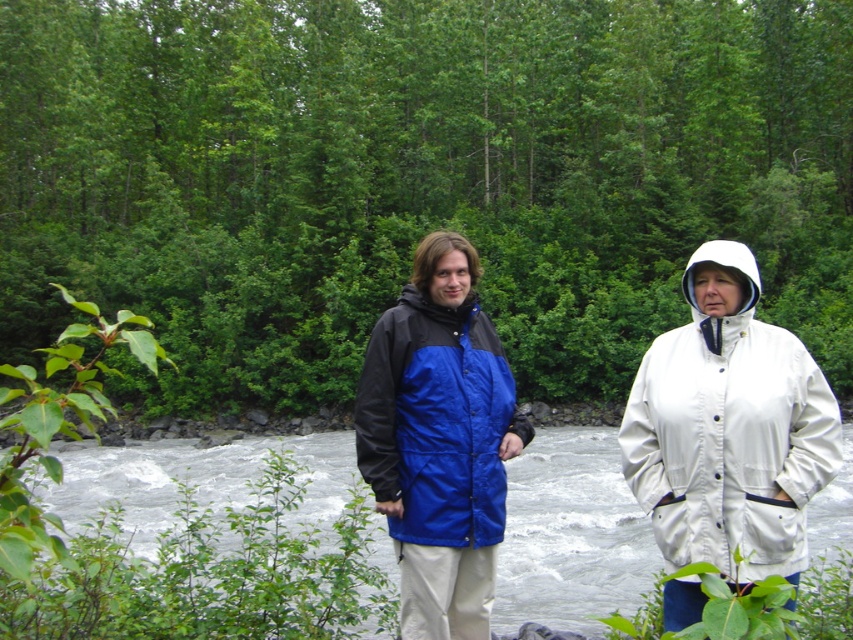
Question: Which point is closer to the camera?

Choices:
 (A) blue/black jacket at center
 (B) blue/white waterproof jacket at center
 (C) white water at river center

Answer: (C)

Question: Is blue/white waterproof jacket at center closer to camera compared to blue/black jacket at center?

Choices:
 (A) no
 (B) yes

Answer: (A)

Question: Is blue/white waterproof jacket at center closer to the viewer compared to white waterproof jacket at center?

Choices:
 (A) no
 (B) yes

Answer: (A)

Question: Is blue/white waterproof jacket at center thinner than white water at river center?

Choices:
 (A) yes
 (B) no

Answer: (A)

Question: Estimate the real-world distances between objects in this image. Which object is closer to the blue/black jacket at center?

Choices:
 (A) white water at river center
 (B) white waterproof jacket at center
 (C) blue/white waterproof jacket at center

Answer: (C)

Question: Which of the following is the closest to the observer?

Choices:
 (A) (x=837, y=460)
 (B) (x=264, y=611)
 (C) (x=424, y=296)

Answer: (A)